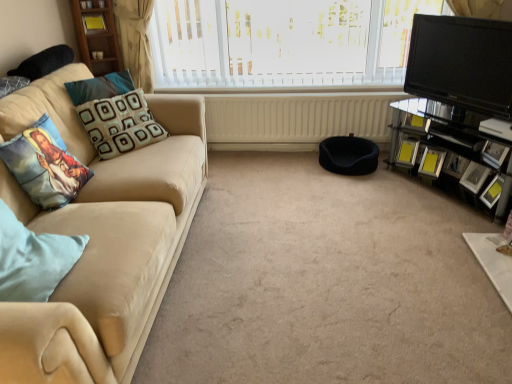
The height and width of the screenshot is (384, 512). In order to click on vacant space in front of black fabric footrest at center in this screenshot , I will do `click(354, 187)`.